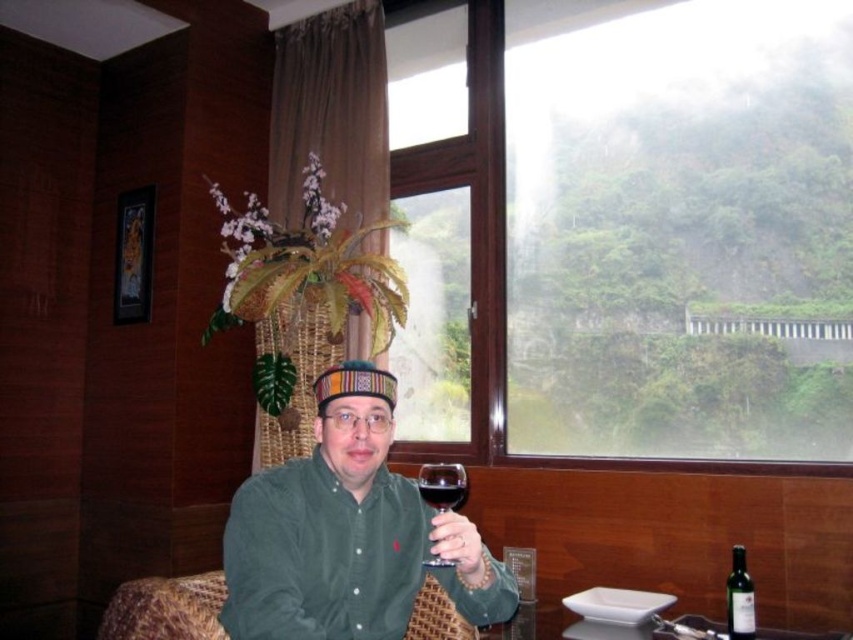
Is green corduroy shirt at center to the left of transparent glass at center from the viewer's perspective?

Correct, you'll find green corduroy shirt at center to the left of transparent glass at center.

Where is `green corduroy shirt at center`? green corduroy shirt at center is located at coordinates (347, 532).

Between green glass bottle at lower right and dark red glass at center, which one appears on the left side from the viewer's perspective?

Positioned to the left is dark red glass at center.

Can you confirm if green glass bottle at lower right is thinner than dark red glass at center?

No, green glass bottle at lower right is not thinner than dark red glass at center.

Is point (727, 608) more distant than point (444, 506)?

That is True.

Locate an element on the screen. green glass bottle at lower right is located at coordinates (740, 596).

Can you confirm if transparent glass at center is positioned below green glass bottle at lower right?

No.

Can you confirm if transparent glass at center is taller than green glass bottle at lower right?

In fact, transparent glass at center may be shorter than green glass bottle at lower right.

Image resolution: width=853 pixels, height=640 pixels. I want to click on transparent glass at center, so click(442, 484).